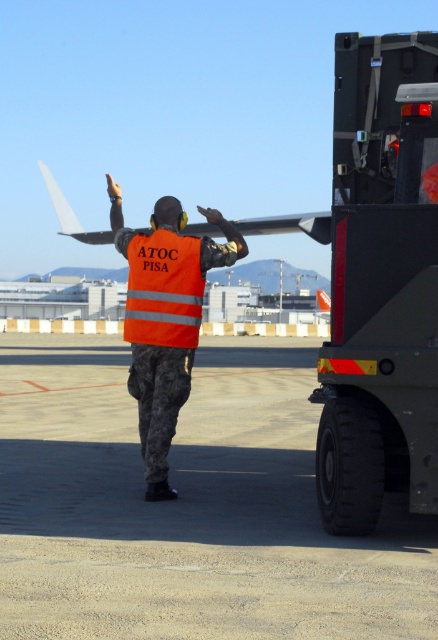
Question: Which point is farther to the camera?

Choices:
 (A) (137, 340)
 (B) (155, 257)
 (C) (208, 406)

Answer: (C)

Question: Which point appears closest to the camera in this image?

Choices:
 (A) pyautogui.click(x=162, y=474)
 (B) pyautogui.click(x=158, y=275)

Answer: (A)

Question: Which point is farther to the camera?

Choices:
 (A) orange reflective vest at center
 (B) gray asphalt tarmac at lower center
 (C) reflective orange safety vest at center

Answer: (A)

Question: Is gray asphalt tarmac at lower center below reflective orange safety vest at center?

Choices:
 (A) yes
 (B) no

Answer: (A)

Question: Can you confirm if gray asphalt tarmac at lower center is positioned to the right of orange reflective vest at center?

Choices:
 (A) yes
 (B) no

Answer: (B)

Question: Is orange reflective vest at center wider than reflective orange safety vest at center?

Choices:
 (A) yes
 (B) no

Answer: (A)